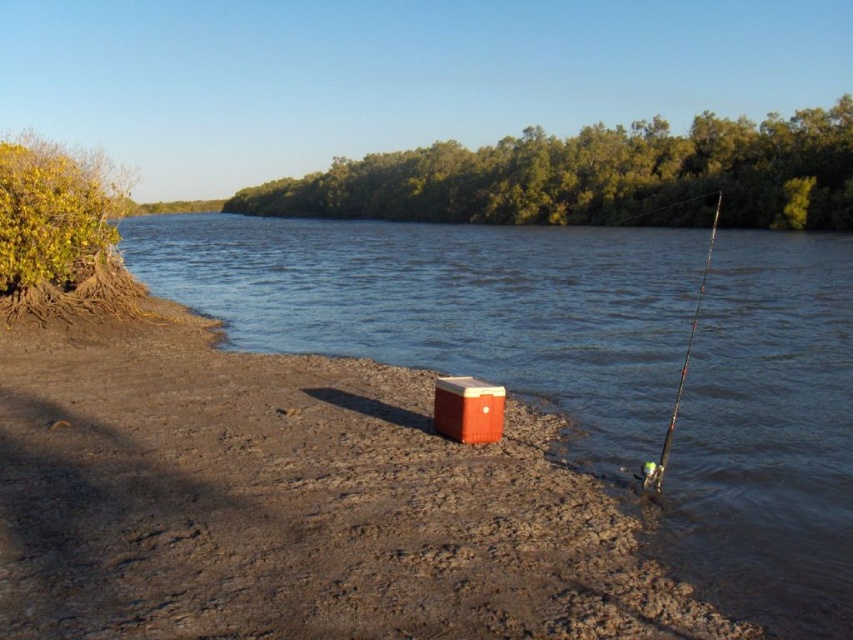
Consider the image. Is the position of smooth water at center more distant than that of orange matte cooler at center?

No, smooth water at center is closer to the viewer.

Who is shorter, smooth water at center or orange matte cooler at center?

Standing shorter between the two is orange matte cooler at center.

This screenshot has width=853, height=640. What do you see at coordinates (454, 307) in the screenshot? I see `smooth water at center` at bounding box center [454, 307].

I want to click on smooth water at center, so click(454, 307).

What do you see at coordinates (467, 410) in the screenshot?
I see `orange matte cooler at center` at bounding box center [467, 410].

Find the location of `orange matte cooler at center`. orange matte cooler at center is located at coordinates (467, 410).

Is smooth water at center to the left of shiny metallic fishing pole at right from the viewer's perspective?

Yes, smooth water at center is to the left of shiny metallic fishing pole at right.

What do you see at coordinates (454, 307) in the screenshot? I see `smooth water at center` at bounding box center [454, 307].

The image size is (853, 640). Describe the element at coordinates (454, 307) in the screenshot. I see `smooth water at center` at that location.

Where is `smooth water at center`? The width and height of the screenshot is (853, 640). smooth water at center is located at coordinates (454, 307).